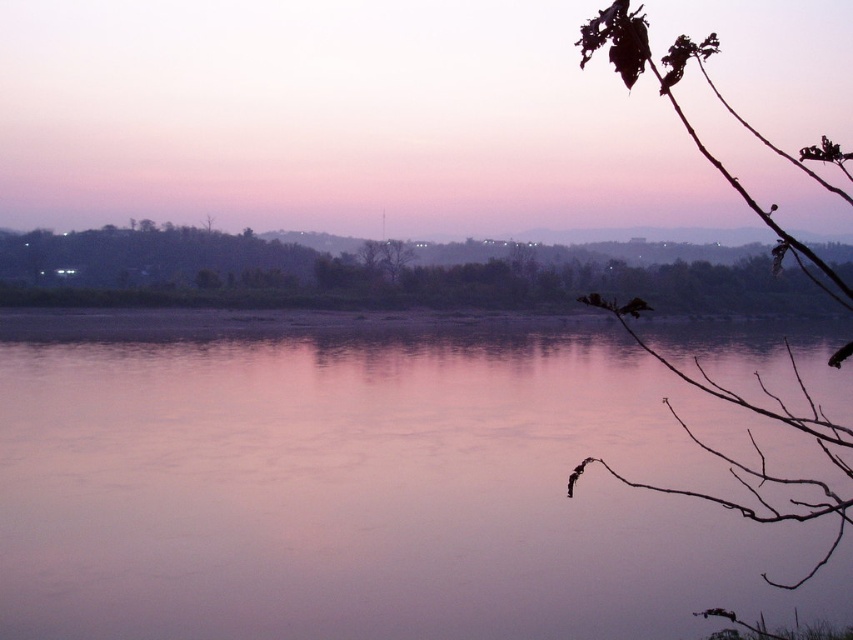
Between smooth water at center and green matte tree at center, which one is positioned lower?

smooth water at center is lower down.

This screenshot has width=853, height=640. Find the location of `smooth water at center`. smooth water at center is located at coordinates (372, 483).

Which is below, pink matte sky at upper center or green matte tree at center?

green matte tree at center is lower down.

This screenshot has height=640, width=853. Identify the location of pink matte sky at upper center. (335, 120).

What do you see at coordinates (335, 120) in the screenshot?
I see `pink matte sky at upper center` at bounding box center [335, 120].

Where is `pink matte sky at upper center`? The height and width of the screenshot is (640, 853). pink matte sky at upper center is located at coordinates (335, 120).

Does pink matte sky at upper center come behind brown/dry branches at upper right?

Yes, it is behind brown/dry branches at upper right.

Is point (288, 44) closer to viewer compared to point (828, 426)?

No.

Find the location of a particular element. The height and width of the screenshot is (640, 853). pink matte sky at upper center is located at coordinates (335, 120).

This screenshot has height=640, width=853. I want to click on pink matte sky at upper center, so click(335, 120).